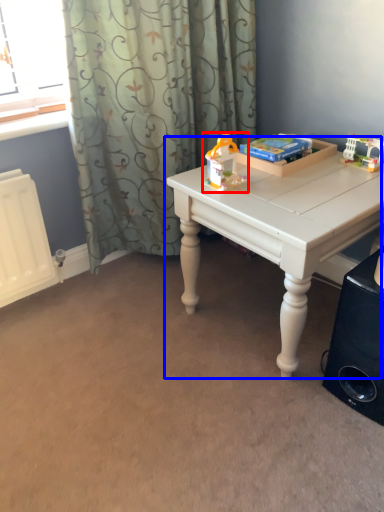
Question: Which object is further to the camera taking this photo, toy (highlighted by a red box) or table (highlighted by a blue box)?

Choices:
 (A) toy
 (B) table

Answer: (A)